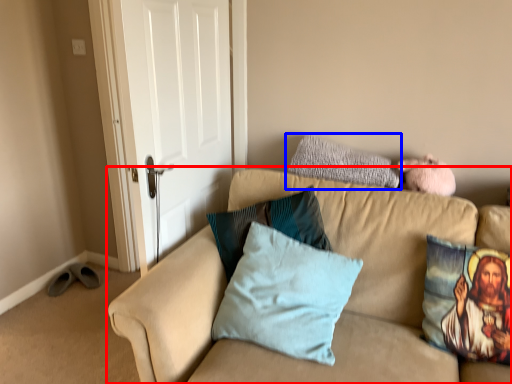
Question: Which of the following is the farthest to the observer, studio couch (highlighted by a red box) or pillow (highlighted by a blue box)?

Choices:
 (A) studio couch
 (B) pillow

Answer: (B)